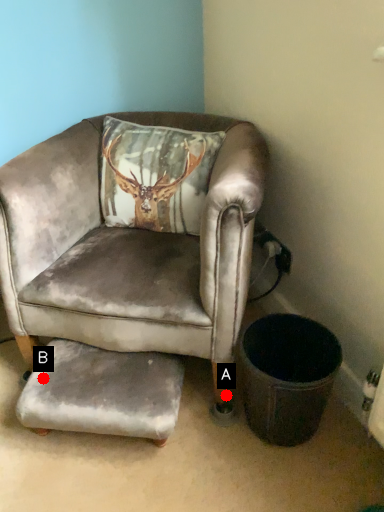
Question: Two points are circled on the image, labeled by A and B beside each circle. Which point is closer to the camera?

Choices:
 (A) A is closer
 (B) B is closer

Answer: (B)